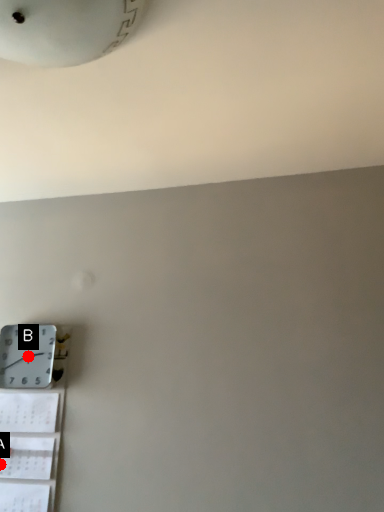
Question: Two points are circled on the image, labeled by A and B beside each circle. Among these points, which one is nearest to the camera?

Choices:
 (A) A is closer
 (B) B is closer

Answer: (A)